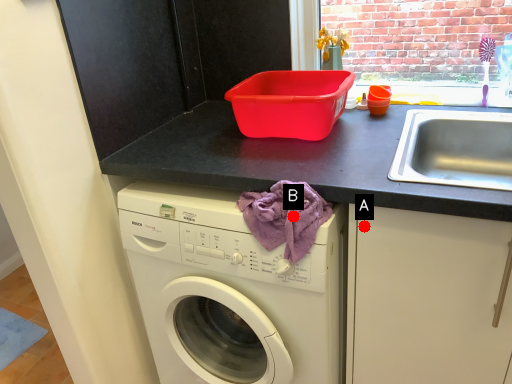
Question: Two points are circled on the image, labeled by A and B beside each circle. Among these points, which one is farthest from the camera?

Choices:
 (A) A is further
 (B) B is further

Answer: (A)